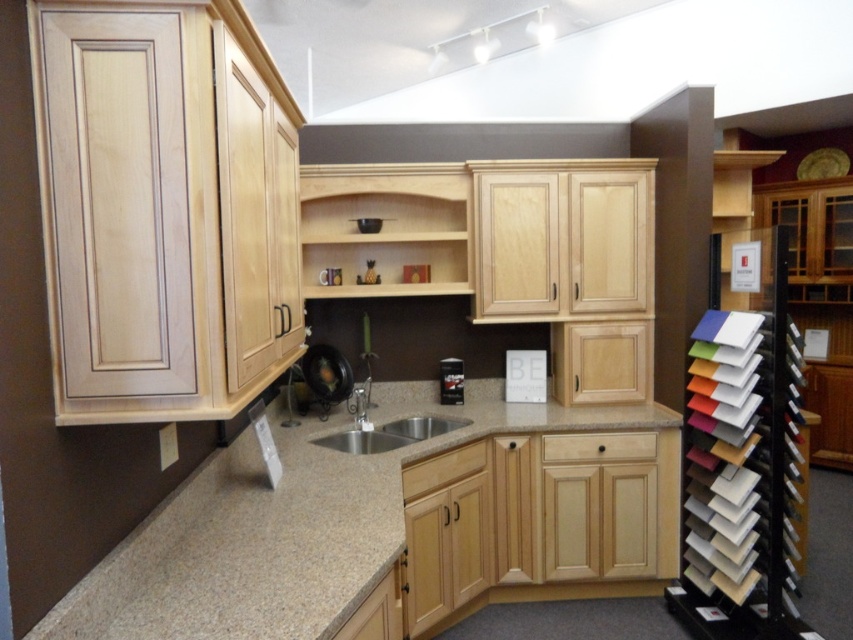
Who is more forward, (599, 552) or (328, 241)?

Positioned in front is point (599, 552).

Which is behind, point (376, 524) or point (389, 179)?

The point (389, 179) is behind.

Where is `granite countertop at center`? The height and width of the screenshot is (640, 853). granite countertop at center is located at coordinates (383, 522).

Does granite countertop at center appear over stainless steel sink at center?

No, granite countertop at center is not above stainless steel sink at center.

Between granite countertop at center and stainless steel sink at center, which one has more height?

granite countertop at center

The image size is (853, 640). What do you see at coordinates (383, 522) in the screenshot?
I see `granite countertop at center` at bounding box center [383, 522].

What are the coordinates of `granite countertop at center` in the screenshot? It's located at (383, 522).

Between point (352, 172) and point (419, 428), which one is positioned behind?

The point (419, 428) is behind.

What do you see at coordinates (386, 227) in the screenshot?
I see `wooden shelves at center` at bounding box center [386, 227].

Where is `wooden shelves at center`? This screenshot has width=853, height=640. wooden shelves at center is located at coordinates (386, 227).